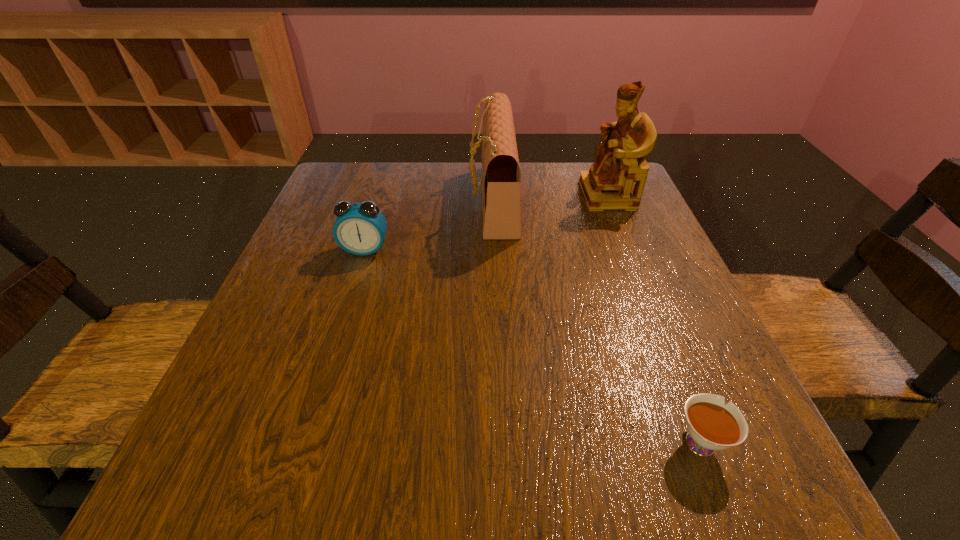
Where is `free space that satisfies the following two spatial constraints: 1. on the side of the teacup with the handle; 2. on the front-facing side of the third shortest object`? free space that satisfies the following two spatial constraints: 1. on the side of the teacup with the handle; 2. on the front-facing side of the third shortest object is located at coordinates (605, 200).

The image size is (960, 540). What are the coordinates of `free spot that satisfies the following two spatial constraints: 1. on the front-facing side of the tallest object; 2. on the face of the third farthest object` in the screenshot? It's located at (630, 249).